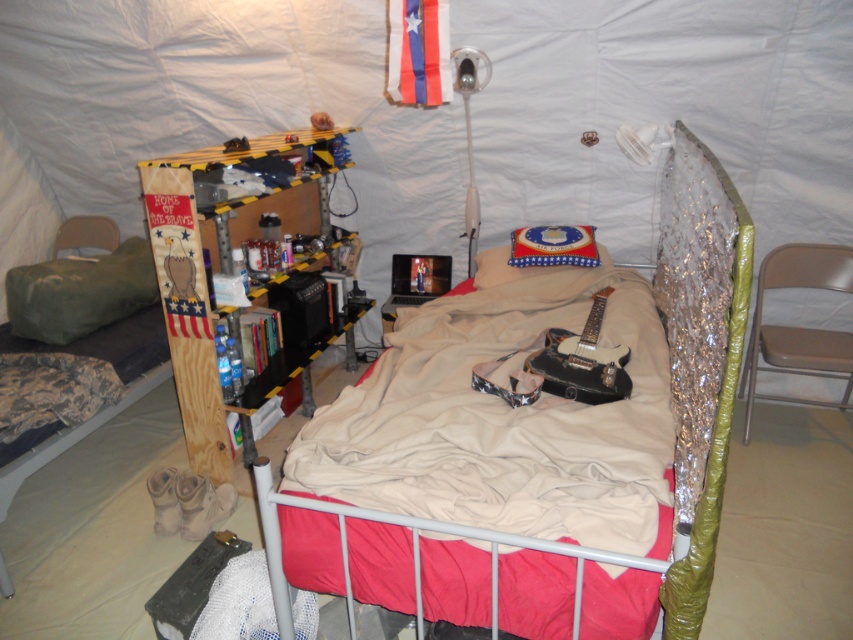
Question: Does metallic silver bed at center have a greater width compared to green fabric pillow at left?

Choices:
 (A) yes
 (B) no

Answer: (A)

Question: Which point is closer to the camera?

Choices:
 (A) metallic silver bed at center
 (B) green fabric pillow at left

Answer: (A)

Question: Can you confirm if metallic silver bed at center is positioned above green fabric pillow at left?

Choices:
 (A) yes
 (B) no

Answer: (B)

Question: Is metallic silver bed at center positioned at the back of green fabric pillow at left?

Choices:
 (A) yes
 (B) no

Answer: (B)